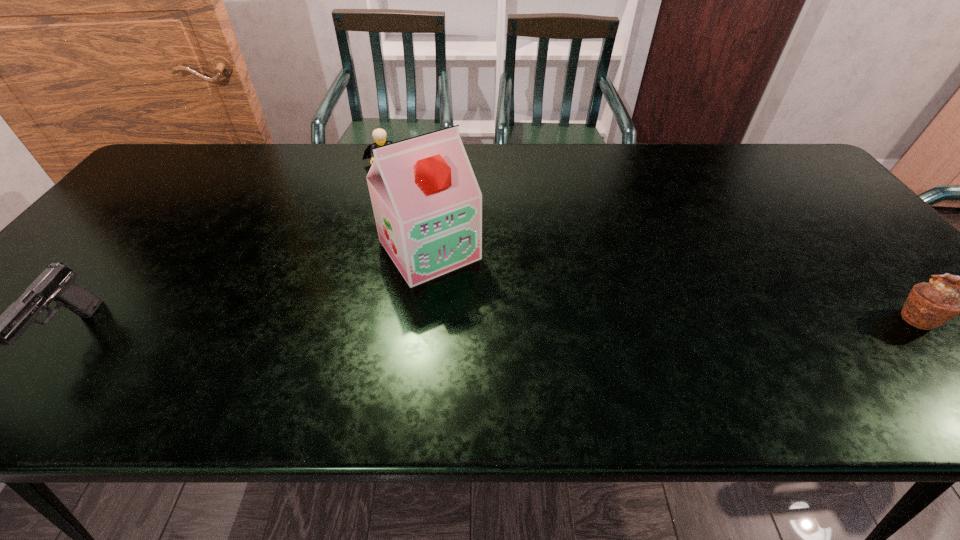
The height and width of the screenshot is (540, 960). Find the location of `the leftmost object`. the leftmost object is located at coordinates (x=56, y=283).

Identify the location of muffin. (929, 305).

Where is `the farthest object`? the farthest object is located at coordinates (379, 135).

I want to click on the second farthest object, so click(427, 204).

Where is `the tallest object`? Image resolution: width=960 pixels, height=540 pixels. the tallest object is located at coordinates (427, 204).

At what (x,y) coordinates should I click in order to perform the action: click on blank area located on the back of the rightmost object. Please return your answer as a coordinate pair (x, y). The image size is (960, 540). Looking at the image, I should click on (838, 229).

The width and height of the screenshot is (960, 540). What are the coordinates of `vacant region located on the front-facing side of the Lego` in the screenshot? It's located at (399, 210).

Where is `free space located on the front-facing side of the Lego`? free space located on the front-facing side of the Lego is located at coordinates (391, 187).

The height and width of the screenshot is (540, 960). I want to click on blank area located on the front-facing side of the Lego, so click(x=406, y=227).

Where is `free space located 0.060m with the cap open on the second farthest object`? The width and height of the screenshot is (960, 540). free space located 0.060m with the cap open on the second farthest object is located at coordinates (467, 299).